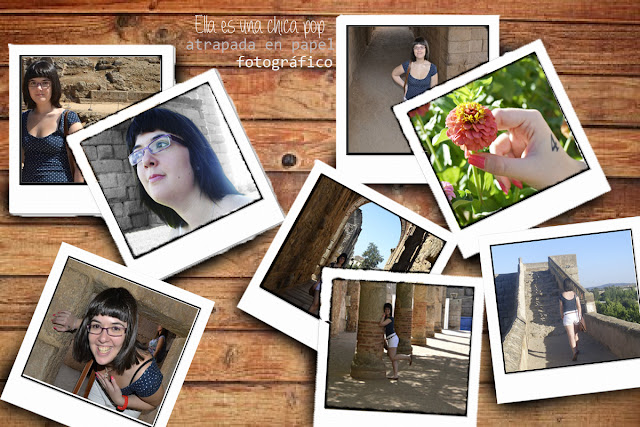
Identify the location of polaroid style photos. This screenshot has width=640, height=427. (57, 98), (136, 161), (81, 362), (338, 242), (376, 304), (557, 284), (486, 150), (409, 67).